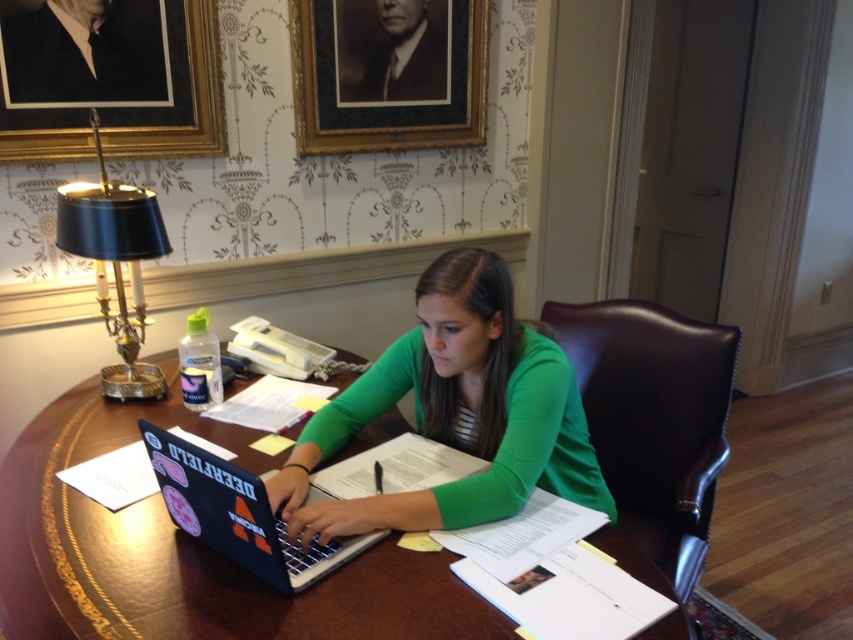
Question: Is green matte shirt at center to the right of black brass lamp at left from the viewer's perspective?

Choices:
 (A) yes
 (B) no

Answer: (A)

Question: Which is nearer to the wooden table at center?

Choices:
 (A) black brass lamp at left
 (B) green matte shirt at center
 (C) gold/gilded picture frame at upper center

Answer: (B)

Question: Is green matte shirt at center bigger than gold framed portrait at upper center?

Choices:
 (A) no
 (B) yes

Answer: (B)

Question: Estimate the real-world distances between objects in this image. Which object is farther from the green matte shirt at center?

Choices:
 (A) gold/gilded picture frame at upper center
 (B) black brass lamp at left
 (C) gold framed portrait at upper center

Answer: (C)

Question: Is gold framed portrait at upper center positioned behind gold/gilded picture frame at upper center?

Choices:
 (A) no
 (B) yes

Answer: (B)

Question: Estimate the real-world distances between objects in this image. Which object is closer to the matte black laptop at center?

Choices:
 (A) wooden table at center
 (B) black brass lamp at left

Answer: (A)